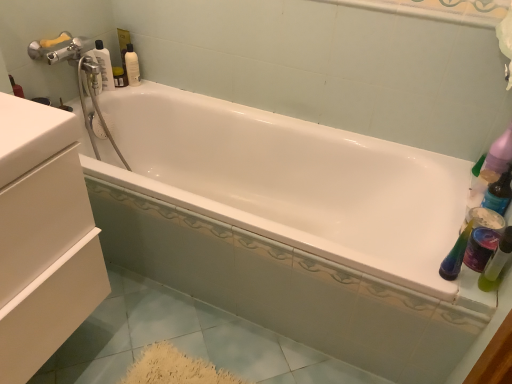
You are a GUI agent. You are given a task and a screenshot of the screen. Output one action in this format:
    pyautogui.click(x=<x>, y=<y>)
    Task: Click on the empty space that is to the right of white glossy mouthwash at upper left, placed as the 1th mouthwash when sorted from top to bottom
    The height and width of the screenshot is (384, 512).
    Given the screenshot: What is the action you would take?
    pyautogui.click(x=157, y=86)